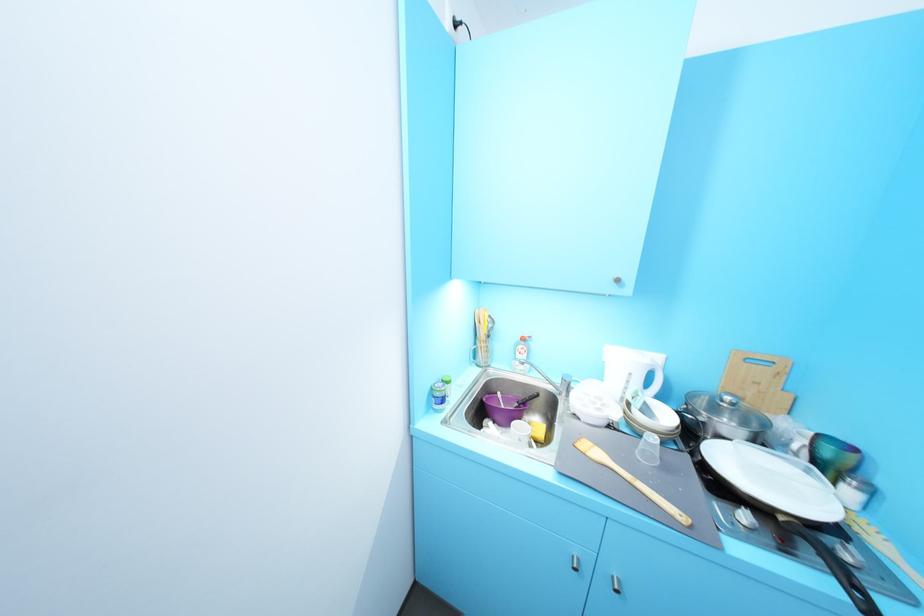
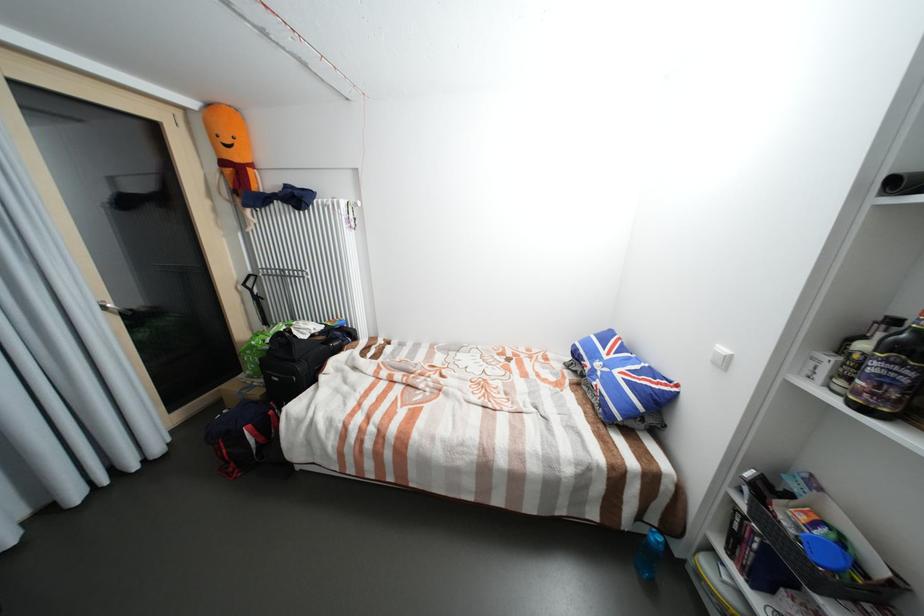
Question: The images are taken continuously from a first-person perspective. In which direction are you moving?

Choices:
 (A) Left
 (B) Right
 (C) Forward
 (D) Backward

Answer: (A)